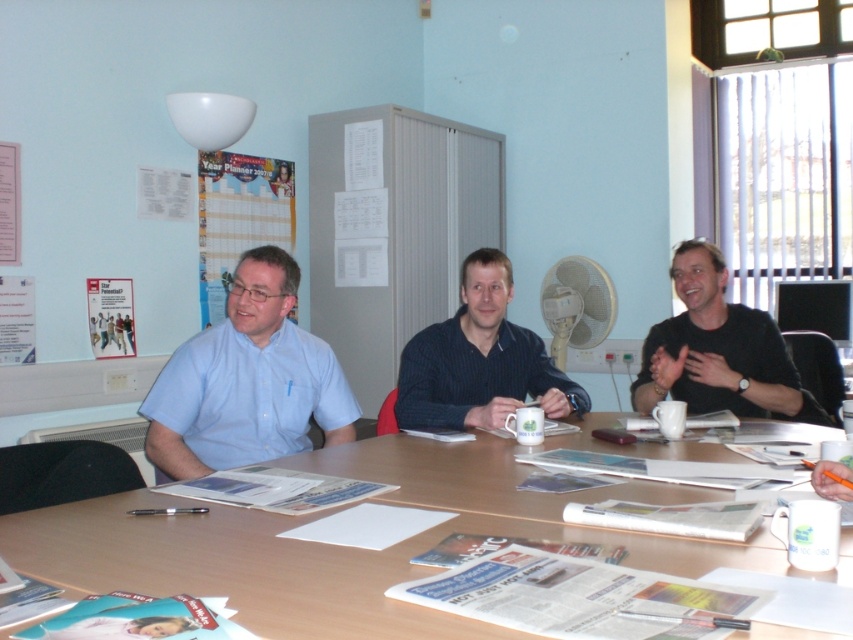
Which is more to the left, light blue shirt at center or black matte shirt at center?

light blue shirt at center is more to the left.

Is light blue shirt at center smaller than black matte shirt at center?

No, light blue shirt at center is not smaller than black matte shirt at center.

Is point (184, 426) positioned before point (643, 380)?

That is True.

This screenshot has height=640, width=853. In order to click on light blue shirt at center in this screenshot , I will do `click(247, 381)`.

Who is more distant from viewer, (236, 300) or (521, 360)?

The point (521, 360) is behind.

Can you confirm if light blue shirt at center is positioned to the left of dark blue textured shirt at center?

Indeed, light blue shirt at center is positioned on the left side of dark blue textured shirt at center.

The image size is (853, 640). What do you see at coordinates (247, 381) in the screenshot?
I see `light blue shirt at center` at bounding box center [247, 381].

The width and height of the screenshot is (853, 640). I want to click on light blue shirt at center, so click(247, 381).

Which is in front, point (833, 572) or point (708, 257)?

Positioned in front is point (833, 572).

Can you confirm if wooden table at center is thinner than black matte shirt at center?

No.

Is point (654, 486) farther from viewer compared to point (763, 352)?

No, it is not.

Where is `wooden table at center`? The image size is (853, 640). wooden table at center is located at coordinates (344, 547).